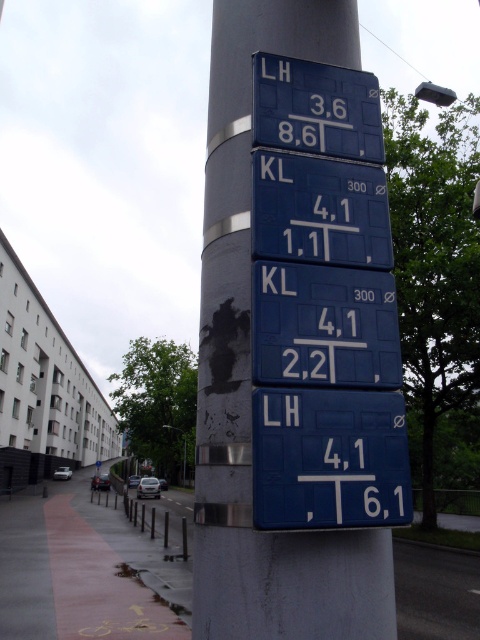
Question: Does blue matte sign at upper center have a greater width compared to matte black lamp post at center?

Choices:
 (A) yes
 (B) no

Answer: (B)

Question: Which object is closer to the camera taking this photo?

Choices:
 (A) black plastic sign at center
 (B) blue matte sign at upper center

Answer: (A)

Question: Which of the following is the closest to the observer?

Choices:
 (A) red asphalt pavement at lower left
 (B) blue matte sign at upper center

Answer: (B)

Question: Does blue matte sign at center come in front of black plastic sign at center?

Choices:
 (A) yes
 (B) no

Answer: (B)

Question: Can you confirm if blue matte parking sign at lower center is bigger than blue metallic sign at center?

Choices:
 (A) no
 (B) yes

Answer: (B)

Question: Which point is closer to the camera?

Choices:
 (A) (305, 294)
 (B) (264, 422)
 (C) (264, 106)

Answer: (B)